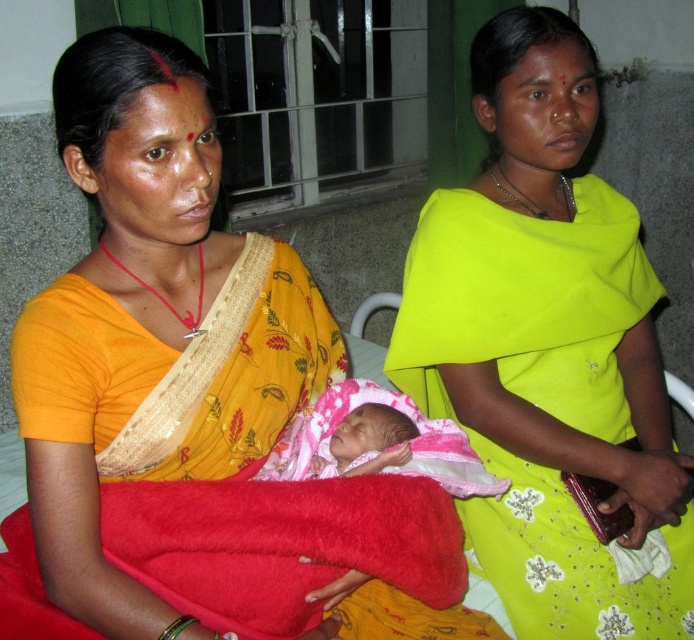
Is point (403, 355) behind point (412, 428)?

Yes, point (403, 355) is farther from viewer.

Who is shorter, matte yellow sari at center or pink fabric newborn at center?

pink fabric newborn at center is shorter.

The width and height of the screenshot is (694, 640). In order to click on matte yellow sari at center in this screenshot , I will do `click(548, 348)`.

Where is `matte yellow sari at center`? Image resolution: width=694 pixels, height=640 pixels. matte yellow sari at center is located at coordinates (548, 348).

Which is behind, point (174, 365) or point (355, 452)?

Positioned behind is point (355, 452).

Can you confirm if matte yellow sari at left is wider than pink fabric newborn at center?

Indeed, matte yellow sari at left has a greater width compared to pink fabric newborn at center.

Describe the element at coordinates (151, 324) in the screenshot. The height and width of the screenshot is (640, 694). I see `matte yellow sari at left` at that location.

Where is `matte yellow sari at left`? matte yellow sari at left is located at coordinates (151, 324).

The image size is (694, 640). What do you see at coordinates (548, 348) in the screenshot? I see `matte yellow sari at center` at bounding box center [548, 348].

Consider the image. Is matte yellow sari at center to the left of matte yellow sari at left from the viewer's perspective?

Incorrect, matte yellow sari at center is not on the left side of matte yellow sari at left.

Is point (511, 410) less distant than point (217, 388)?

That is False.

Image resolution: width=694 pixels, height=640 pixels. I want to click on matte yellow sari at center, so click(548, 348).